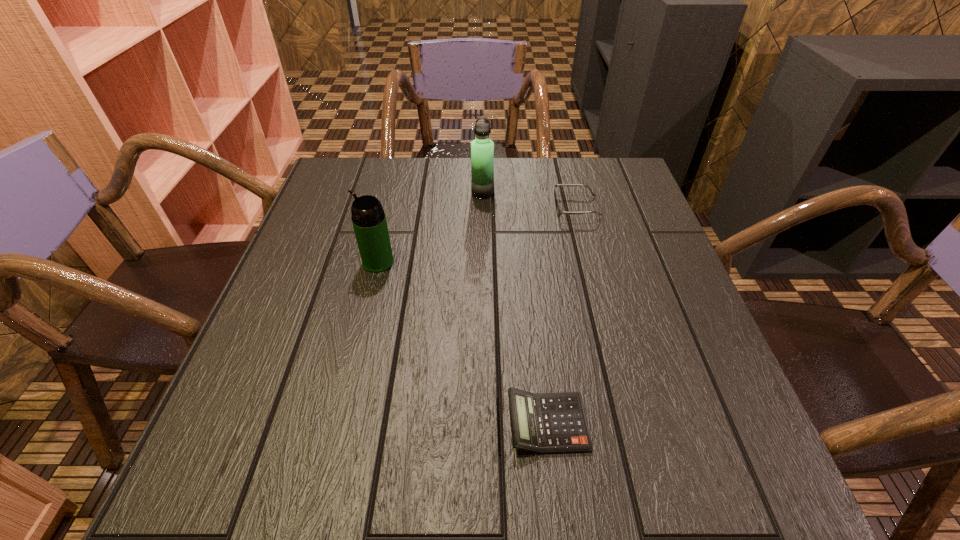
I want to click on vacant space at the far edge, so click(x=420, y=179).

Where is `free space at the left edge of the desktop`? Image resolution: width=960 pixels, height=540 pixels. free space at the left edge of the desktop is located at coordinates (304, 356).

Image resolution: width=960 pixels, height=540 pixels. Find the location of `free space at the right edge of the desktop`. free space at the right edge of the desktop is located at coordinates (588, 211).

Where is `vacant space at the far left corner`? The height and width of the screenshot is (540, 960). vacant space at the far left corner is located at coordinates (387, 162).

Locate an element on the screen. The image size is (960, 540). vacant area at the far right corner of the desktop is located at coordinates (608, 181).

The width and height of the screenshot is (960, 540). I want to click on free space between the nearer thermos bottle and the rightmost object, so click(x=477, y=234).

The width and height of the screenshot is (960, 540). Identify the location of empty space that is in between the farther thermos bottle and the nearest object. (515, 308).

Locate an element on the screen. vacant area between the right thermos bottle and the leftmost object is located at coordinates (430, 227).

Where is `vacant space that's between the nearer thermos bottle and the rightmost object`? This screenshot has width=960, height=540. vacant space that's between the nearer thermos bottle and the rightmost object is located at coordinates (477, 234).

Find the location of a particular element. unoccupied position between the second nearest object and the third object from left to right is located at coordinates (463, 342).